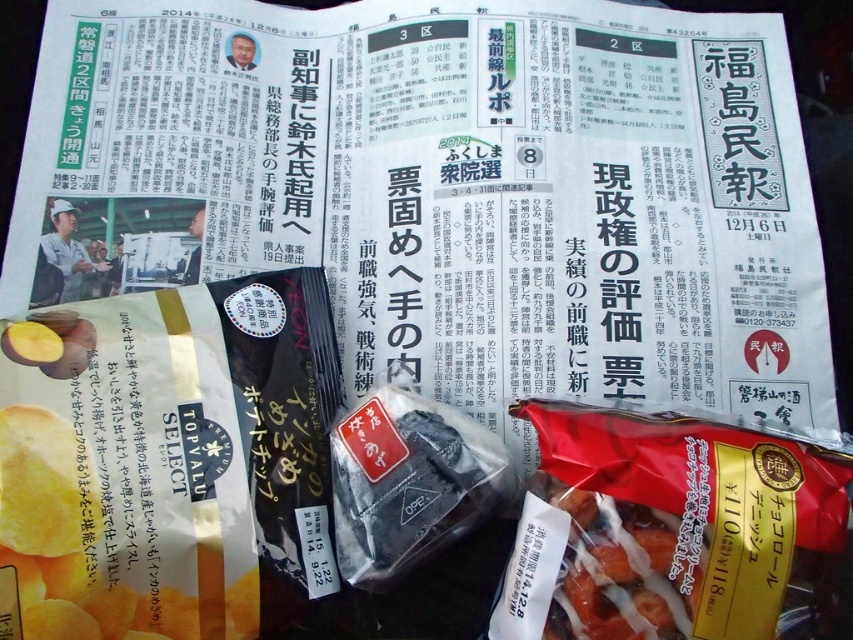
From the picture: You are organizing snacks on a table and see the yellow matte potato chips at lower left and the shiny brown snack at center. Which snack is positioned more to the left?

The yellow matte potato chips at lower left are positioned more to the left than the shiny brown snack at center.

You are a delivery person who needs to place a small package between the yellow matte potato chips at lower left and the black matte bag at center on the newspaper. The package is 3 inches wide. Can you fit it there?

The distance between the yellow matte potato chips at lower left and the black matte bag at center is 8.79 inches. Since the package is only 3 inches wide, there is enough space to fit it between them.